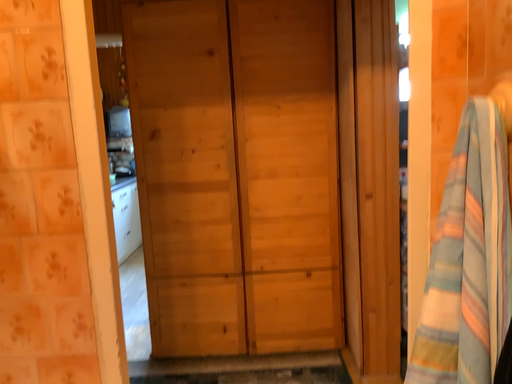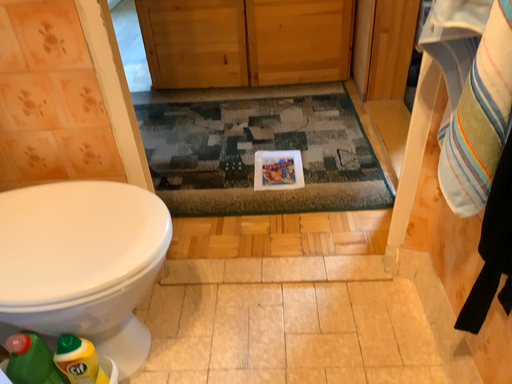
Question: Which way did the camera rotate in the video?

Choices:
 (A) rotated downward
 (B) rotated upward

Answer: (A)